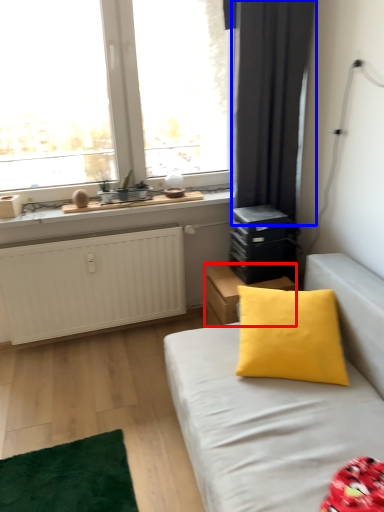
Question: Among these objects, which one is nearest to the camera, nightstand (highlighted by a red box) or curtain (highlighted by a blue box)?

Choices:
 (A) nightstand
 (B) curtain

Answer: (B)